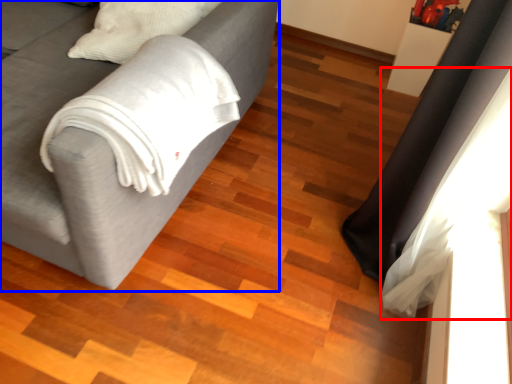
Question: Which point is further to the camera, curtain (highlighted by a red box) or studio couch (highlighted by a blue box)?

Choices:
 (A) curtain
 (B) studio couch

Answer: (A)